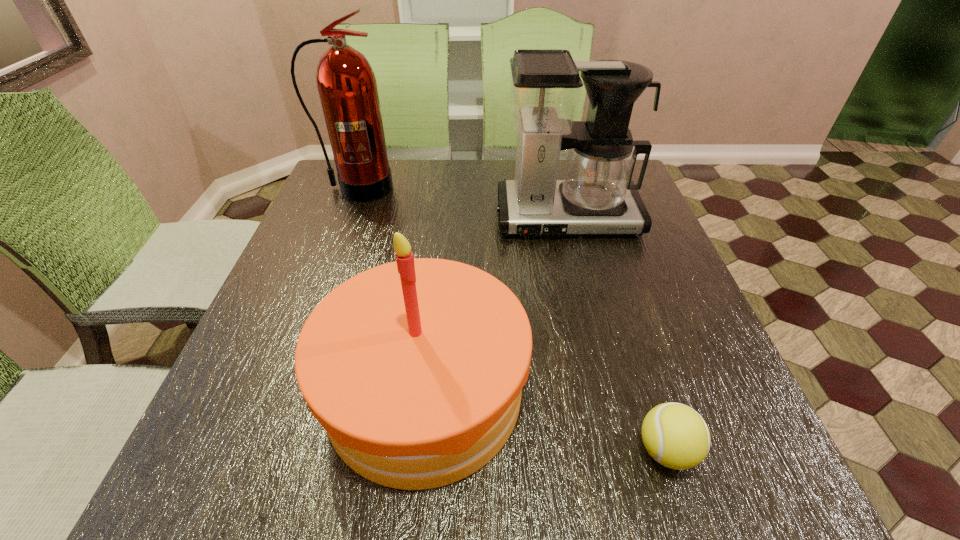
Select which object appears as the second closest to the birthday cake. Please provide its 2D coordinates. Your answer should be formatted as a tuple, i.e. [(x, y)], where the tuple contains the x and y coordinates of a point satisfying the conditions above.

[(596, 196)]

Identify the location of the closest object to the coffee maker. This screenshot has height=540, width=960. (415, 368).

Locate an element on the screen. free point that satisfies the following two spatial constraints: 1. on the front side of the tennis ball; 2. on the right side of the birthday cake is located at coordinates (418, 450).

Locate an element on the screen. The image size is (960, 540). free location that satisfies the following two spatial constraints: 1. at the front of the tennis ball where the controls are located; 2. on the left side of the coffee maker is located at coordinates (624, 450).

I want to click on blank space that satisfies the following two spatial constraints: 1. on the front-facing side of the fire extinguisher; 2. on the right side of the tennis ball, so click(x=257, y=450).

Locate an element on the screen. Image resolution: width=960 pixels, height=540 pixels. free location that satisfies the following two spatial constraints: 1. on the front-facing side of the fire extinguisher; 2. on the right side of the tennis ball is located at coordinates (257, 450).

Locate an element on the screen. This screenshot has width=960, height=540. free location that satisfies the following two spatial constraints: 1. on the front-facing side of the fire extinguisher; 2. on the right side of the tennis ball is located at coordinates (257, 450).

At what (x,y) coordinates should I click in order to perform the action: click on vacant region that satisfies the following two spatial constraints: 1. at the front of the coffee maker where the controls are located; 2. on the right side of the tennis ball. Please return your answer as a coordinate pair (x, y). Looking at the image, I should click on pyautogui.click(x=624, y=450).